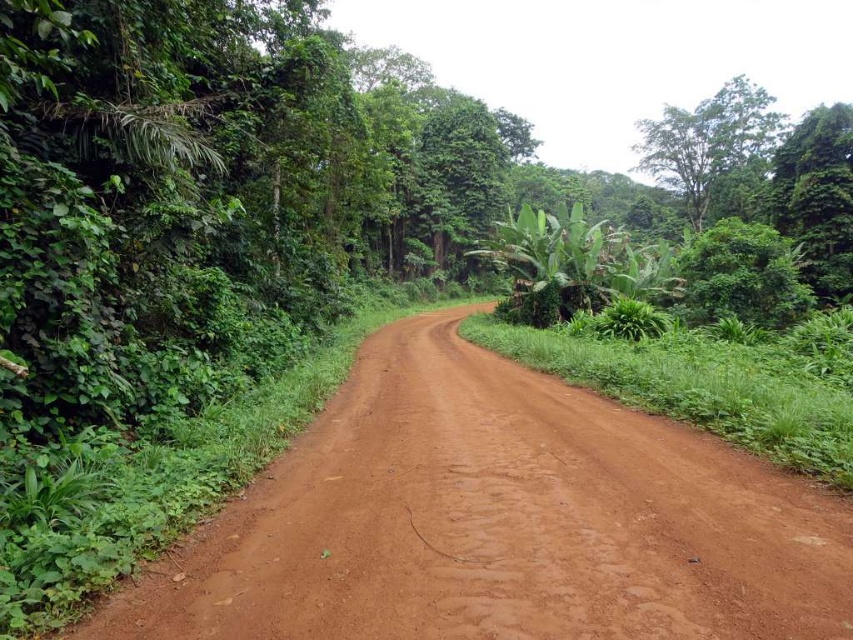
You are standing at the point with coordinates point (730, 154) and want to walk towards the point with coordinates point (791, 512). According to the image, which direction should you face to walk towards the correct point?

You should face forward because point (791, 512) is in front of point (730, 154).

You are a hiker standing on the dusty brown dirt track at center and want to reach the green leafy tree at upper right. Which direction should you walk to get closer to the tree?

The green leafy tree at upper right is located at the upper right of the image, so you should walk towards the upper right direction to get closer to it. However, the dusty brown dirt track at center is closer to you than the tree, so following the track towards the curve might lead you in the right direction.